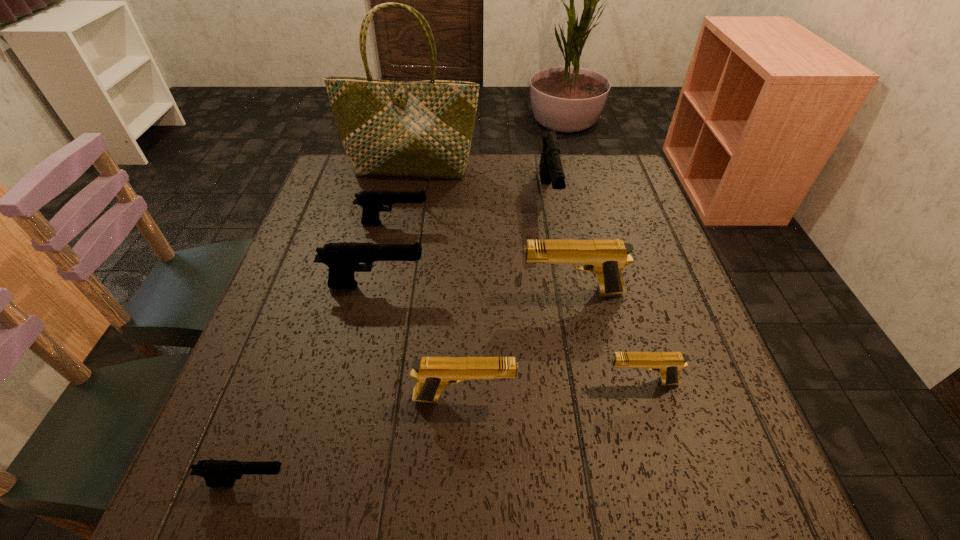
The width and height of the screenshot is (960, 540). Identify the location of vacant space at the far edge of the desktop. (443, 198).

The width and height of the screenshot is (960, 540). Identify the location of free space at the near edge of the desktop. [x=430, y=466].

Locate an element on the screen. This screenshot has width=960, height=540. vacant point at the left edge is located at coordinates click(x=281, y=440).

The height and width of the screenshot is (540, 960). What are the coordinates of `free space at the right edge of the desktop` in the screenshot? It's located at (693, 360).

The width and height of the screenshot is (960, 540). In the image, there is a desktop. In order to click on free space at the far right corner in this screenshot , I will do `click(617, 154)`.

In order to click on blank space at the near right corner of the desktop in this screenshot , I will do `click(755, 516)`.

What are the coordinates of `free space between the second smallest black pistol and the fifth farthest pistol` in the screenshot? It's located at (517, 302).

The image size is (960, 540). Find the location of `free spot between the rightmost black pistol and the tallest object`. free spot between the rightmost black pistol and the tallest object is located at coordinates (480, 183).

Where is `vacant region between the second smallest black pistol and the farthest tan pistol`? vacant region between the second smallest black pistol and the farthest tan pistol is located at coordinates (483, 258).

Locate an element on the screen. vacant area that lies between the nearest pistol and the fourth pistol from right to left is located at coordinates (356, 440).